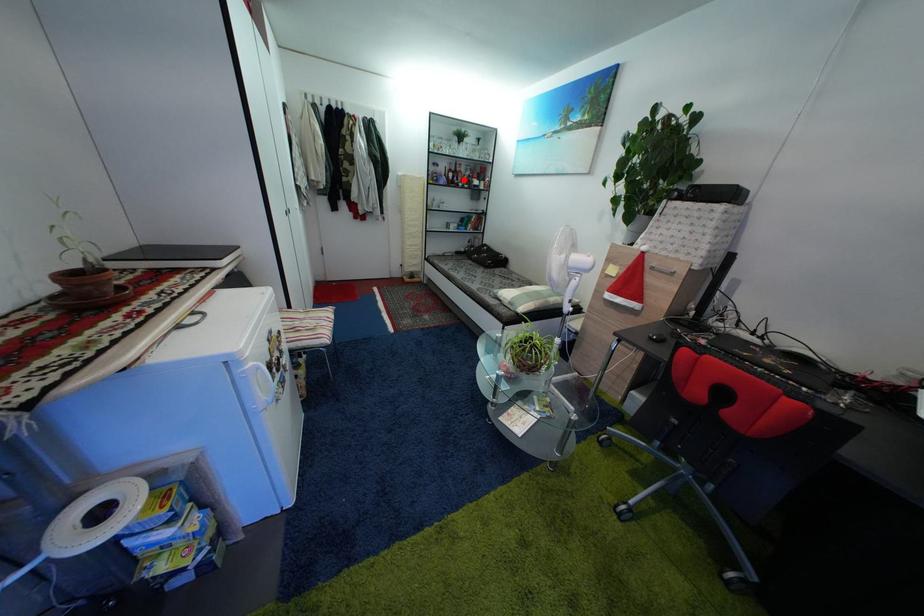
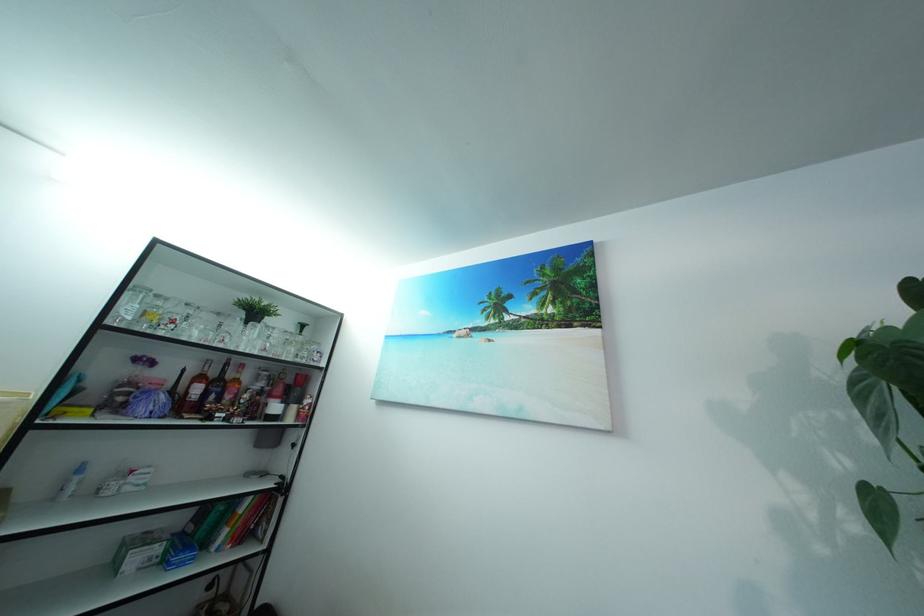
The point at the highlighted location is marked in the first image. Where is the corresponding point in the second image?

(226, 391)